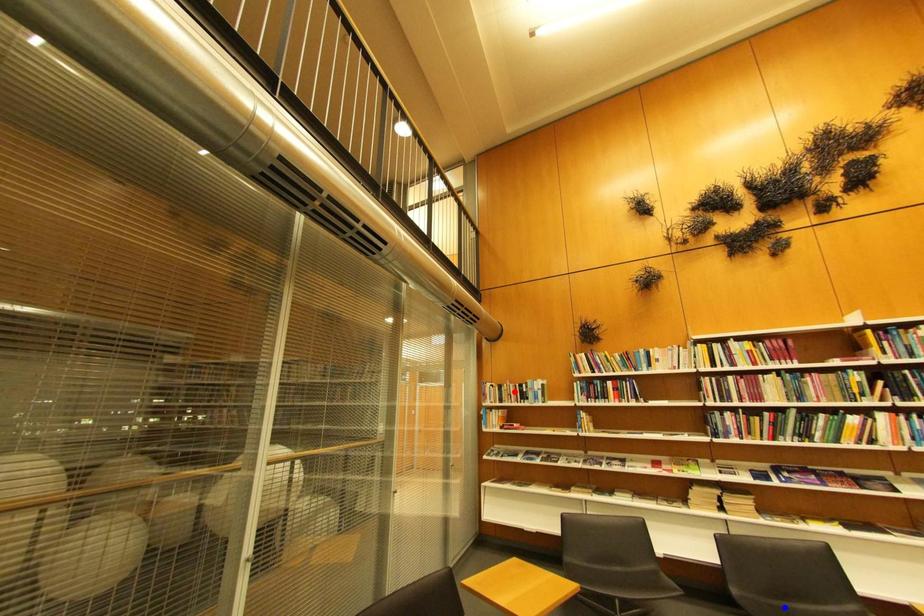
Question: Two points are marked on the image. Which point is closer to the camera?

Choices:
 (A) Blue point is closer.
 (B) Red point is closer.

Answer: (A)